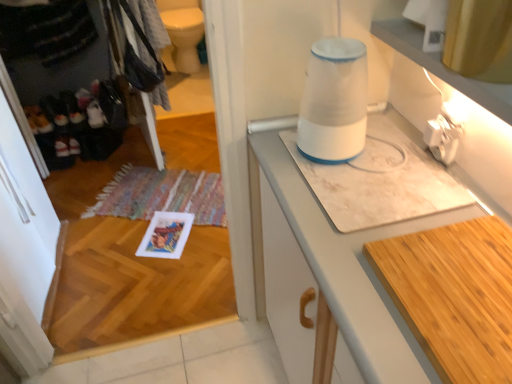
Identify the location of free space above white marble countertop at center (from a real-world perspective). (400, 211).